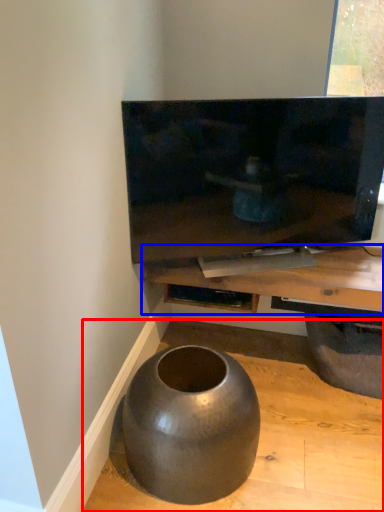
Question: Which of the following is the closest to the observer, concrete (highlighted by a red box) or table (highlighted by a blue box)?

Choices:
 (A) concrete
 (B) table

Answer: (A)